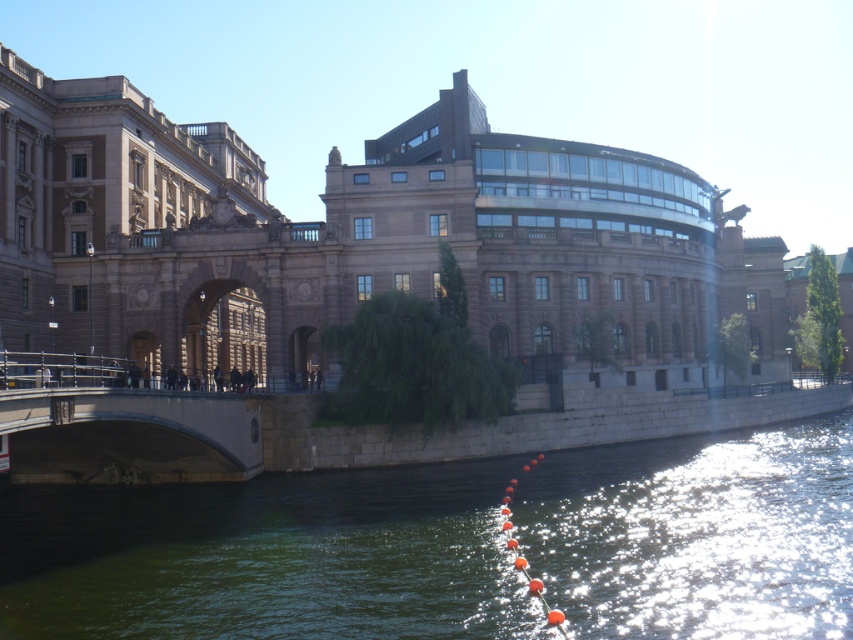
Is point (631, 570) more distant than point (36, 442)?

No, (631, 570) is closer to viewer.

Can you confirm if green stone river at lower left is positioned to the right of concrete bridge at lower left?

Yes, green stone river at lower left is to the right of concrete bridge at lower left.

Image resolution: width=853 pixels, height=640 pixels. What do you see at coordinates (454, 547) in the screenshot?
I see `green stone river at lower left` at bounding box center [454, 547].

This screenshot has height=640, width=853. What are the coordinates of `green stone river at lower left` in the screenshot? It's located at (454, 547).